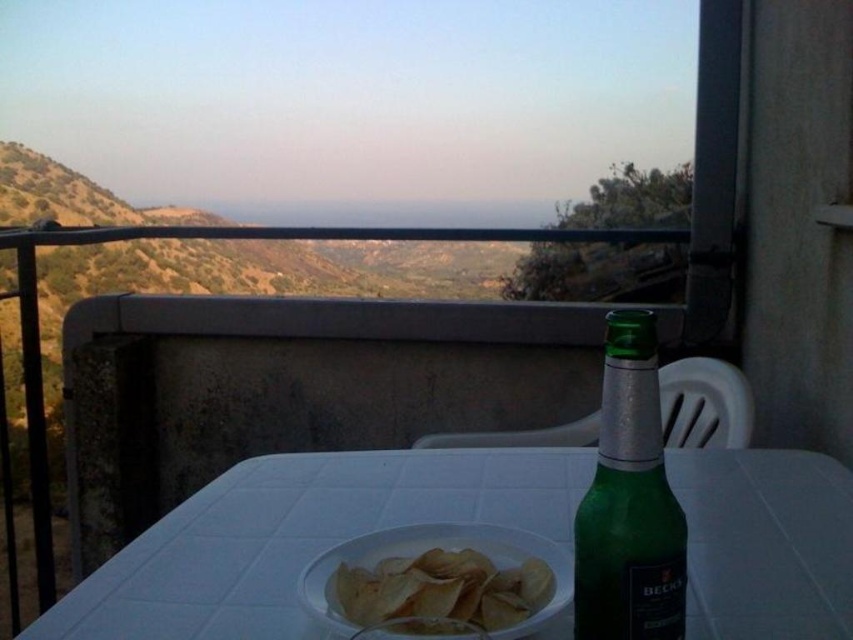
Question: Which of these objects is positioned closest to the golden crispy chips at center?

Choices:
 (A) white plastic table at center
 (B) green glass bottle at center right

Answer: (B)

Question: Is white plastic table at center thinner than golden crispy chips at center?

Choices:
 (A) yes
 (B) no

Answer: (B)

Question: Can you confirm if green glass bottle at center right is positioned to the right of golden crispy chips at center?

Choices:
 (A) yes
 (B) no

Answer: (A)

Question: Which point appears farthest from the camera in this image?

Choices:
 (A) (440, 621)
 (B) (294, 531)
 (C) (596, 486)

Answer: (B)

Question: Can you confirm if white plastic table at center is bigger than green glass bottle at center right?

Choices:
 (A) yes
 (B) no

Answer: (A)

Question: Which object is closer to the camera taking this photo?

Choices:
 (A) white plastic table at center
 (B) green glass bottle at center right
 (C) golden crispy chips at center

Answer: (B)